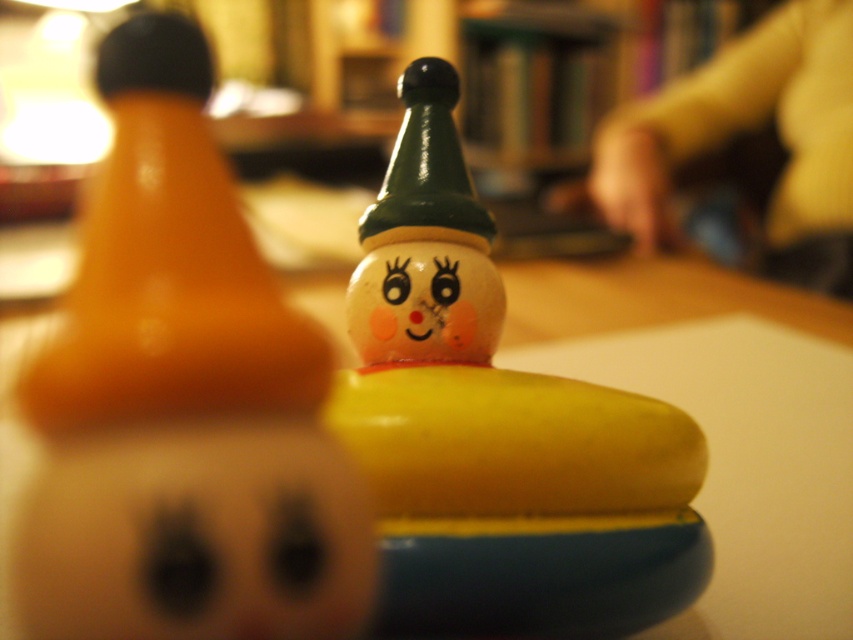
You are a child who wants to place both the matte orange rubber duck at left and the matte plastic face at center into a box that is 40 centimeters wide. Will both items fit side by side in the box?

The matte orange rubber duck at left and the matte plastic face at center are 41.84 centimeters apart, so they cannot fit side by side in a 40 centimeter wide box since the combined width exceeds the box width.

You are a child who wants to grab both the matte orange rubber duck at left and the wooden clown at center. Which one can you reach first without moving your hand?

The matte orange rubber duck at left is closer to the viewer than the wooden clown at center, so you can reach it first without moving your hand.